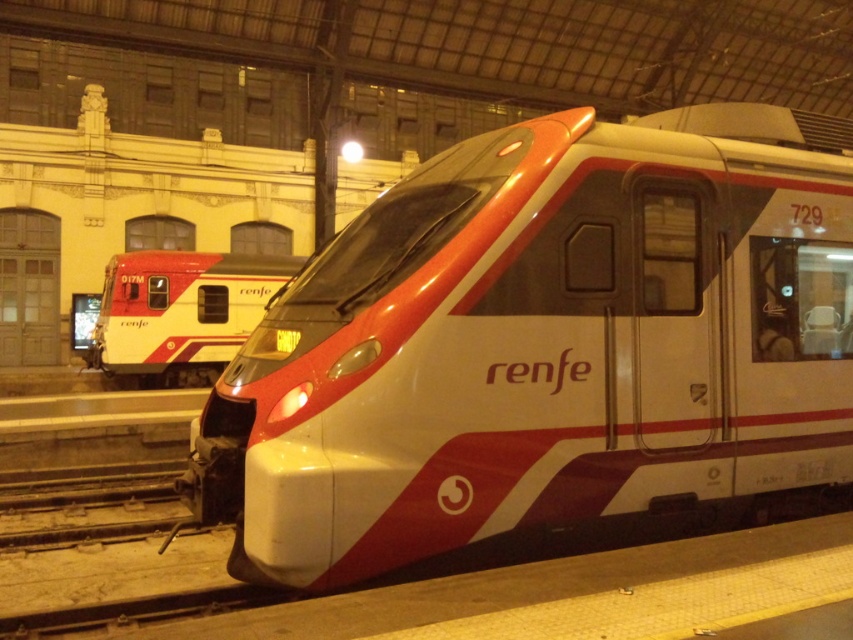
Question: Among these points, which one is farthest from the camera?

Choices:
 (A) (102, 292)
 (B) (721, 476)

Answer: (A)

Question: Is matte white train at center bigger than matte white train at left?

Choices:
 (A) yes
 (B) no

Answer: (B)

Question: Is matte white train at center to the right of matte white train at left from the viewer's perspective?

Choices:
 (A) no
 (B) yes

Answer: (B)

Question: Which point is closer to the camera?

Choices:
 (A) matte white train at center
 (B) matte white train at left

Answer: (A)

Question: Which point is closer to the camera taking this photo?

Choices:
 (A) (213, 323)
 (B) (817, 259)

Answer: (B)

Question: Is matte white train at center to the right of matte white train at left from the viewer's perspective?

Choices:
 (A) yes
 (B) no

Answer: (A)